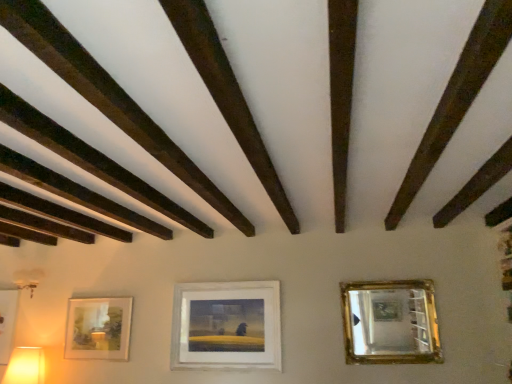
Question: Considering the relative positions of matte white picture frame at lower left, acting as the third picture frame starting from the right, and dark brown wood at upper left in the image provided, is matte white picture frame at lower left, acting as the third picture frame starting from the right, in front of dark brown wood at upper left?

Choices:
 (A) yes
 (B) no

Answer: (B)

Question: Does matte white picture frame at lower left, acting as the third picture frame starting from the right, have a greater height compared to dark brown wood at upper left?

Choices:
 (A) no
 (B) yes

Answer: (B)

Question: Is the position of matte white picture frame at lower left, acting as the third picture frame starting from the right, more distant than that of dark brown wood at upper left?

Choices:
 (A) no
 (B) yes

Answer: (B)

Question: From the image's perspective, would you say matte white picture frame at lower left, placed as the 1th picture frame when sorted from left to right, is positioned over dark brown wood at upper left?

Choices:
 (A) no
 (B) yes

Answer: (A)

Question: Can you confirm if matte white picture frame at lower left, acting as the third picture frame starting from the right, is positioned to the right of dark brown wood at upper left?

Choices:
 (A) yes
 (B) no

Answer: (B)

Question: Is matte white picture frame at center, arranged as the first picture frame when viewed from the right, spatially inside dark brown wood at upper left, or outside of it?

Choices:
 (A) inside
 (B) outside

Answer: (B)

Question: Considering the positions of point (216, 337) and point (223, 208), is point (216, 337) closer or farther from the camera than point (223, 208)?

Choices:
 (A) closer
 (B) farther

Answer: (B)

Question: Visually, is matte white picture frame at center, arranged as the first picture frame when viewed from the right, positioned to the left or to the right of dark brown wood at upper left?

Choices:
 (A) right
 (B) left

Answer: (A)

Question: Considering the positions of matte white picture frame at center, arranged as the first picture frame when viewed from the right, and dark brown wood at upper left in the image, is matte white picture frame at center, arranged as the first picture frame when viewed from the right, bigger or smaller than dark brown wood at upper left?

Choices:
 (A) big
 (B) small

Answer: (A)

Question: Is matte white picture frame at center, arranged as the third picture frame when viewed from the left, wider or thinner than matte yellow plastic table lamp at lower left?

Choices:
 (A) thin
 (B) wide

Answer: (A)

Question: From a real-world perspective, is matte white picture frame at center, arranged as the third picture frame when viewed from the left, above or below matte yellow plastic table lamp at lower left?

Choices:
 (A) below
 (B) above

Answer: (B)

Question: In the image, is matte white picture frame at center, arranged as the first picture frame when viewed from the right, on the left side or the right side of matte yellow plastic table lamp at lower left?

Choices:
 (A) right
 (B) left

Answer: (A)

Question: From their relative heights in the image, would you say matte white picture frame at center, arranged as the first picture frame when viewed from the right, is taller or shorter than matte yellow plastic table lamp at lower left?

Choices:
 (A) short
 (B) tall

Answer: (B)

Question: From a real-world perspective, relative to dark brown wood at upper left, is matte yellow plastic table lamp at lower left vertically above or below?

Choices:
 (A) above
 (B) below

Answer: (B)

Question: Is matte yellow plastic table lamp at lower left to the left or to the right of dark brown wood at upper left in the image?

Choices:
 (A) left
 (B) right

Answer: (A)